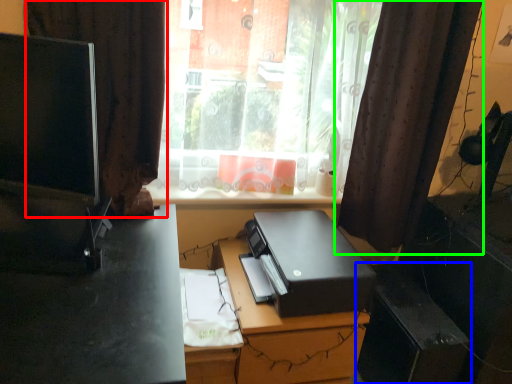
Question: Which object is the closest to the curtain (highlighted by a red box)? Choose among these: file cabinet (highlighted by a blue box) or curtain (highlighted by a green box).

Choices:
 (A) file cabinet
 (B) curtain

Answer: (B)